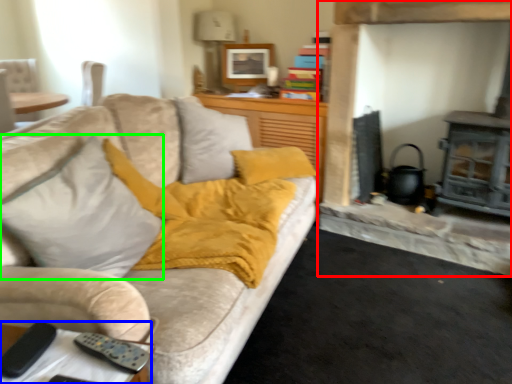
Question: Which object is the closest to the fireplace (highlighted by a red box)? Choose among these: table (highlighted by a blue box) or throw pillow (highlighted by a green box).

Choices:
 (A) table
 (B) throw pillow

Answer: (B)